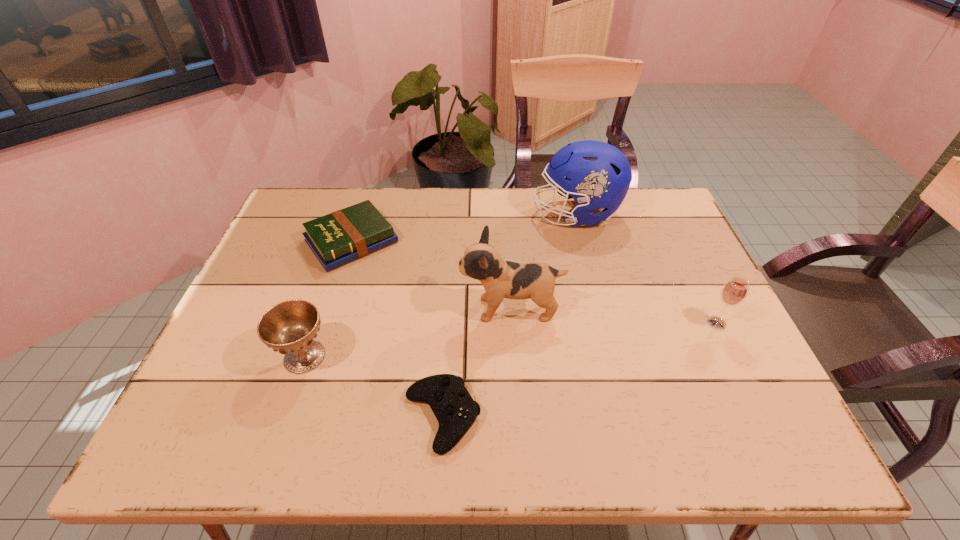
At what (x,y) coordinates should I click in order to perform the action: click on football helmet. Please return your answer as a coordinate pair (x, y). The image size is (960, 540). Looking at the image, I should click on (597, 175).

I want to click on puppy, so click(501, 279).

You are a GUI agent. You are given a task and a screenshot of the screen. Output one action in this format:
    pyautogui.click(x=<x>, y=<y>)
    Task: Click on the rightmost object
    
    Given the screenshot: What is the action you would take?
    pyautogui.click(x=734, y=292)

Locate an element on the screen. The height and width of the screenshot is (540, 960). chalice is located at coordinates (290, 327).

Identify the location of book. This screenshot has height=540, width=960. (345, 235).

Where is `control`? This screenshot has width=960, height=540. control is located at coordinates (454, 408).

Identify the location of the nearest object. (454, 408).

Image resolution: width=960 pixels, height=540 pixels. Find the location of `free space located 0.400m on the face guard of the football helmet`. free space located 0.400m on the face guard of the football helmet is located at coordinates (406, 214).

Locate an element on the screen. This screenshot has height=540, width=960. vacant position located on the face guard of the football helmet is located at coordinates (434, 214).

Where is `vacant position located on the face guard of the football helmet`? The image size is (960, 540). vacant position located on the face guard of the football helmet is located at coordinates (503, 214).